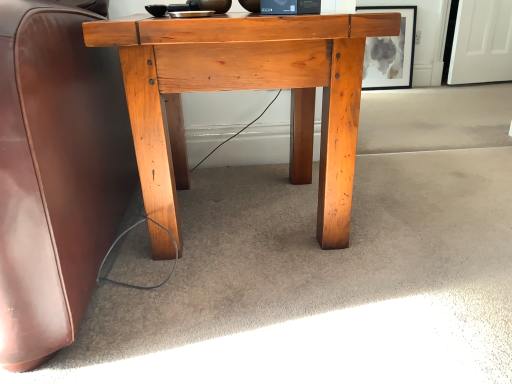
Where is `free space underneath matte black picture frame at upper center (from a real-world perspective)`? The height and width of the screenshot is (384, 512). free space underneath matte black picture frame at upper center (from a real-world perspective) is located at coordinates (384, 92).